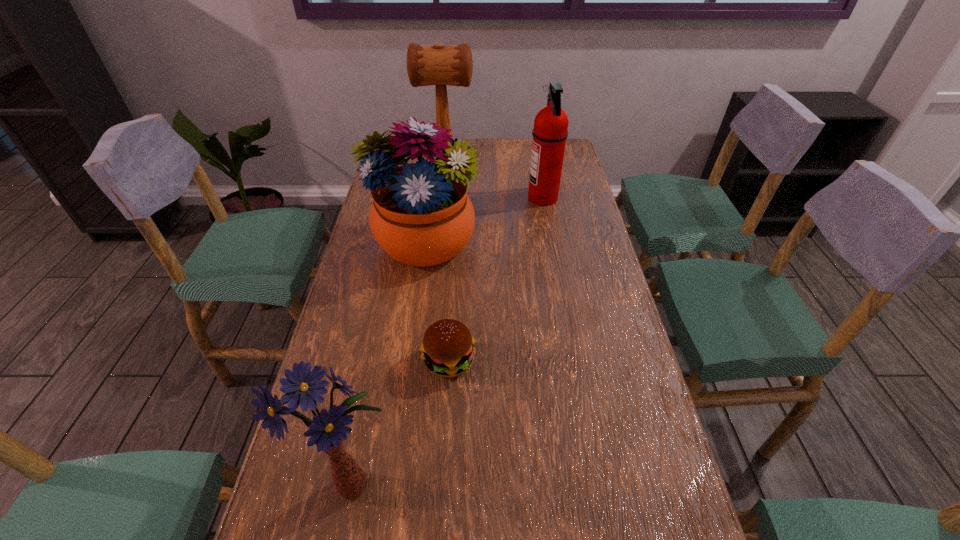
Where is `mallet`? Image resolution: width=960 pixels, height=540 pixels. mallet is located at coordinates (438, 65).

Where is `fire extinguisher`? This screenshot has height=540, width=960. fire extinguisher is located at coordinates (550, 131).

Locate an element on the screen. the rightmost object is located at coordinates (550, 131).

This screenshot has height=540, width=960. I want to click on the third nearest object, so click(x=421, y=216).

Locate an element on the screen. This screenshot has width=960, height=540. the nearer flower arrangement is located at coordinates (327, 430).

The width and height of the screenshot is (960, 540). Identify the location of the fourth farthest object. (448, 346).

What are the coordinates of `hamburger` in the screenshot? It's located at (448, 346).

Where is `vacant space situated on the strike surface of the farthest object`? The width and height of the screenshot is (960, 540). vacant space situated on the strike surface of the farthest object is located at coordinates (487, 153).

Identify the location of free space located on the side of the rightmost object near the handle. This screenshot has height=540, width=960. (498, 198).

At what (x,y) coordinates should I click in order to perform the action: click on free space located on the side of the rightmost object near the handle. Please return your answer as a coordinate pair (x, y). Image resolution: width=960 pixels, height=540 pixels. Looking at the image, I should click on (435, 198).